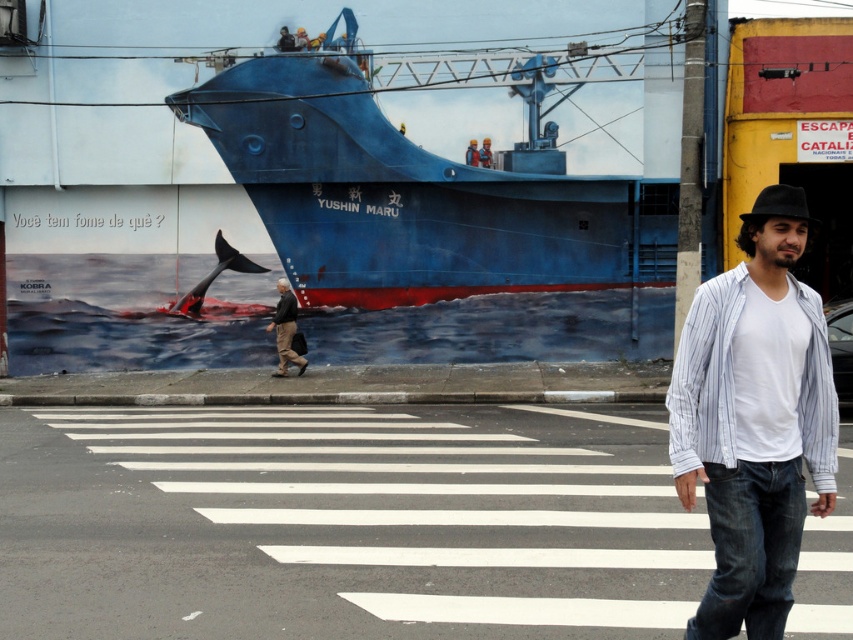
What do you see at coordinates (416, 192) in the screenshot? I see `blue matte ship at center` at bounding box center [416, 192].

Who is more distant from viewer, [476,172] or [299,358]?

The point [476,172] is more distant.

The width and height of the screenshot is (853, 640). What are the coordinates of `blue matte ship at center` in the screenshot? It's located at (416, 192).

Is white cotton shirt at center smaller than brown leather jacket at center?

Incorrect, white cotton shirt at center is not smaller in size than brown leather jacket at center.

Between point (802, 240) and point (296, 308), which one is positioned in front?

Point (802, 240) is more forward.

You are a GUI agent. You are given a task and a screenshot of the screen. Output one action in this format:
    pyautogui.click(x=<x>, y=<y>)
    Task: Click on the white cotton shirt at center
    
    Given the screenshot: What is the action you would take?
    pyautogui.click(x=753, y=419)

Which is more to the left, blue matte ship at center or white cotton shirt at center?

From the viewer's perspective, blue matte ship at center appears more on the left side.

Is blue matte ship at center smaller than white cotton shirt at center?

Correct, blue matte ship at center occupies less space than white cotton shirt at center.

Between point (433, 195) and point (819, 308), which one is positioned in front?

Point (819, 308)

Locate an element on the screen. blue matte ship at center is located at coordinates (416, 192).